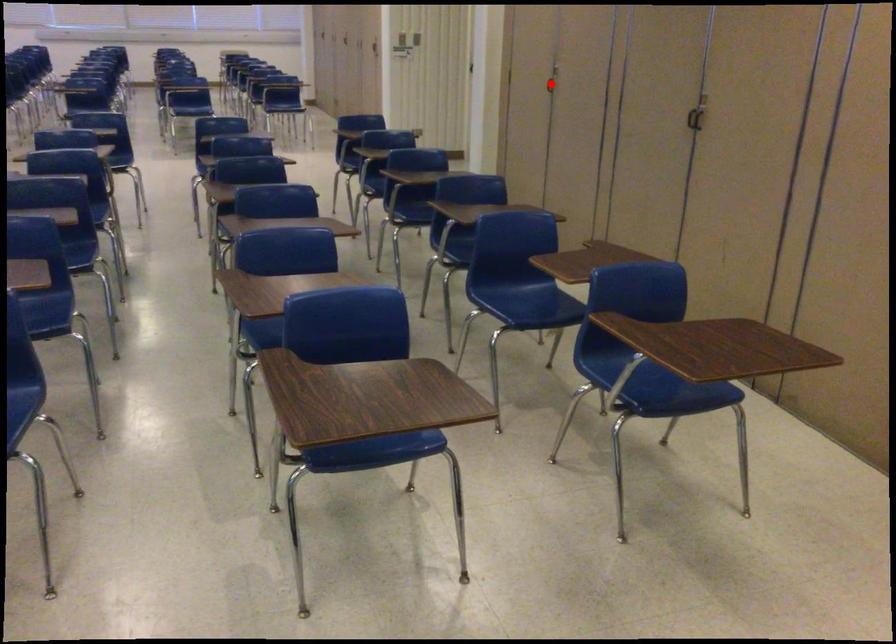
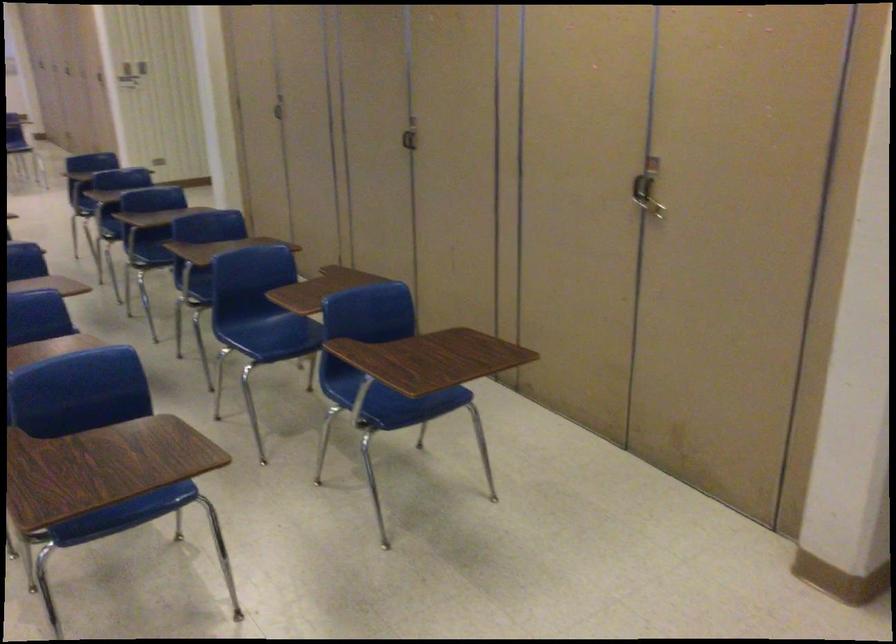
The point at the highlighted location is marked in the first image. Where is the corresponding point in the second image?

(279, 107)